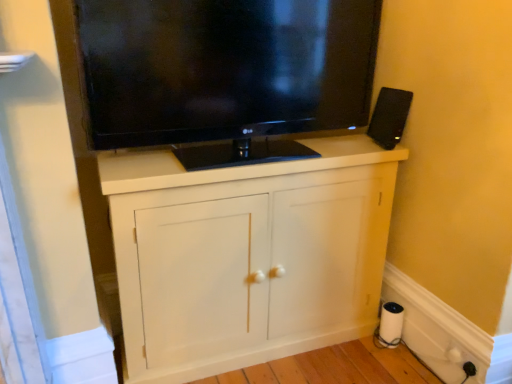
Question: Is the depth of white matte paper towel at lower right greater than that of white matte cabinet at center?

Choices:
 (A) no
 (B) yes

Answer: (B)

Question: From the image's perspective, is white matte paper towel at lower right located beneath white matte cabinet at center?

Choices:
 (A) yes
 (B) no

Answer: (A)

Question: Is white matte paper towel at lower right with white matte cabinet at center?

Choices:
 (A) no
 (B) yes

Answer: (A)

Question: From a real-world perspective, is white matte paper towel at lower right positioned under white matte cabinet at center based on gravity?

Choices:
 (A) no
 (B) yes

Answer: (B)

Question: Considering the relative sizes of white matte paper towel at lower right and white matte cabinet at center in the image provided, is white matte paper towel at lower right taller than white matte cabinet at center?

Choices:
 (A) yes
 (B) no

Answer: (B)

Question: Would you say white matte cabinet at center is part of white matte paper towel at lower right's contents?

Choices:
 (A) yes
 (B) no

Answer: (B)

Question: Can we say white matte paper towel at lower right lies outside white plastic electric outlet at lower right, the 2th electric outlet when ordered from left to right?

Choices:
 (A) no
 (B) yes

Answer: (B)

Question: Is the depth of white matte paper towel at lower right greater than that of white plastic electric outlet at lower right, the 2th electric outlet when ordered from left to right?

Choices:
 (A) no
 (B) yes

Answer: (B)

Question: Can you confirm if white matte paper towel at lower right is shorter than white plastic electric outlet at lower right, which is the 1th electric outlet in right-to-left order?

Choices:
 (A) no
 (B) yes

Answer: (A)

Question: Is white matte paper towel at lower right closer to the viewer compared to white plastic electric outlet at lower right, which is the 1th electric outlet in right-to-left order?

Choices:
 (A) no
 (B) yes

Answer: (A)

Question: Considering the relative positions of white matte paper towel at lower right and white plastic electric outlet at lower right, the 2th electric outlet when ordered from left to right, in the image provided, is white matte paper towel at lower right to the right of white plastic electric outlet at lower right, the 2th electric outlet when ordered from left to right, from the viewer's perspective?

Choices:
 (A) no
 (B) yes

Answer: (A)

Question: Does white matte paper towel at lower right have a smaller size compared to white plastic electric outlet at lower right, the 2th electric outlet when ordered from left to right?

Choices:
 (A) no
 (B) yes

Answer: (A)

Question: Is white matte cabinet at center not close to black plastic speaker at upper right?

Choices:
 (A) no
 (B) yes

Answer: (A)